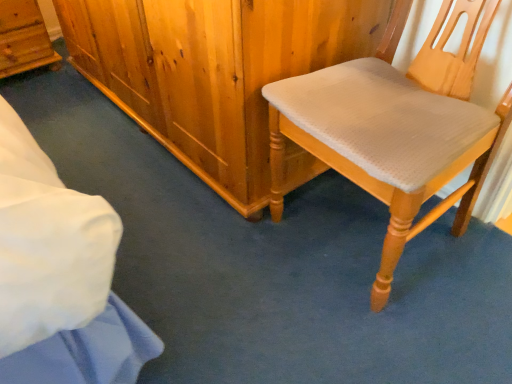
Question: Can you confirm if wooden cabinet at upper left is positioned to the right of light wood/texture chair at right?

Choices:
 (A) no
 (B) yes

Answer: (A)

Question: Is wooden cabinet at upper left facing towards light wood/texture chair at right?

Choices:
 (A) no
 (B) yes

Answer: (B)

Question: From a real-world perspective, is wooden cabinet at upper left located higher than light wood/texture chair at right?

Choices:
 (A) yes
 (B) no

Answer: (B)

Question: Considering the relative sizes of wooden cabinet at upper left and light wood/texture chair at right in the image provided, is wooden cabinet at upper left thinner than light wood/texture chair at right?

Choices:
 (A) no
 (B) yes

Answer: (B)

Question: Can you confirm if wooden cabinet at upper left is taller than light wood/texture chair at right?

Choices:
 (A) no
 (B) yes

Answer: (A)

Question: Is wooden cabinet at upper left closer to camera compared to light wood/texture chair at right?

Choices:
 (A) yes
 (B) no

Answer: (B)

Question: From the image's perspective, does light wood/texture chair at right appear lower than wooden cabinet at upper left?

Choices:
 (A) yes
 (B) no

Answer: (A)

Question: From the image's perspective, would you say light wood/texture chair at right is positioned over wooden cabinet at upper left?

Choices:
 (A) yes
 (B) no

Answer: (B)

Question: Is wooden cabinet at upper left surrounded by light wood/texture chair at right?

Choices:
 (A) yes
 (B) no

Answer: (B)

Question: Does light wood/texture chair at right have a lesser width compared to wooden cabinet at upper left?

Choices:
 (A) yes
 (B) no

Answer: (B)

Question: Is light wood/texture chair at right oriented away from wooden cabinet at upper left?

Choices:
 (A) yes
 (B) no

Answer: (B)

Question: Is light wood/texture chair at right far from wooden cabinet at upper left?

Choices:
 (A) yes
 (B) no

Answer: (A)

Question: Is light wood/texture chair at right to the left or to the right of wooden cabinet at upper left in the image?

Choices:
 (A) left
 (B) right

Answer: (B)